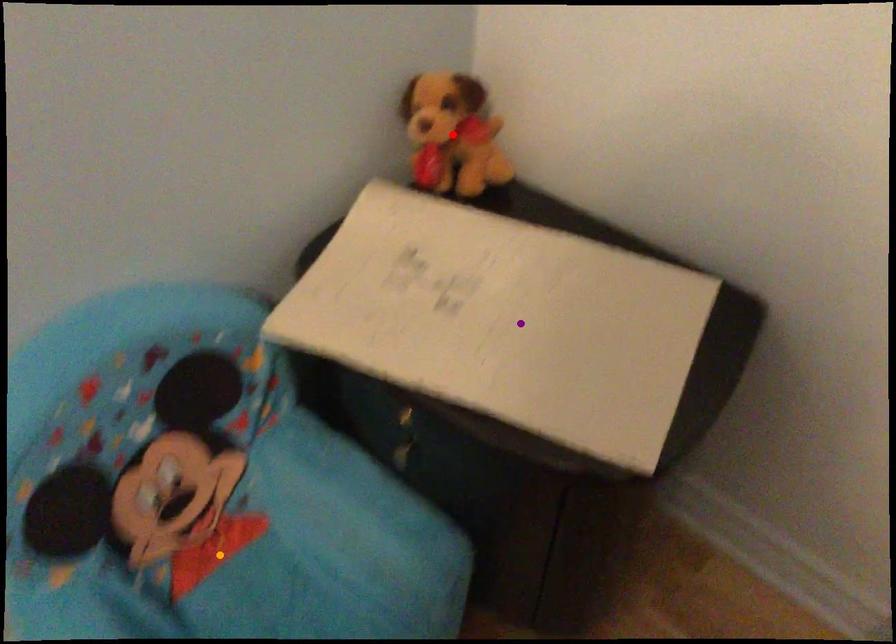
Order these from nearest to farthest:
1. red point
2. orange point
3. purple point

red point → orange point → purple point